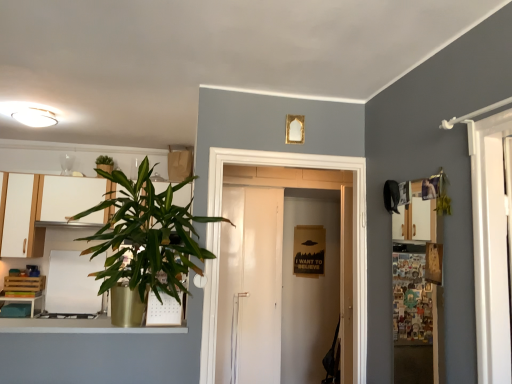
Question: From the image's perspective, would you say matte white cabinet at left, which appears as the 1th cabinetry when viewed from the left, is shown under green leafy plant at upper left, acting as the 2th houseplant starting from the right?

Choices:
 (A) yes
 (B) no

Answer: (A)

Question: Is matte white cabinet at left, which appears as the 1th cabinetry when viewed from the left, at the right side of green leafy plant at upper left, which appears as the first houseplant when viewed from the top?

Choices:
 (A) yes
 (B) no

Answer: (B)

Question: Can you confirm if matte white cabinet at left, which appears as the 1th cabinetry when viewed from the left, is bigger than green leafy plant at upper left, the first houseplant viewed from the left?

Choices:
 (A) yes
 (B) no

Answer: (A)

Question: Considering the relative positions of matte white cabinet at left, the 2th cabinetry viewed from the right, and green leafy plant at upper left, which appears as the first houseplant when viewed from the top, in the image provided, is matte white cabinet at left, the 2th cabinetry viewed from the right, to the left of green leafy plant at upper left, which appears as the first houseplant when viewed from the top, from the viewer's perspective?

Choices:
 (A) yes
 (B) no

Answer: (A)

Question: Is green leafy plant at upper left, the first houseplant viewed from the left, located within matte white cabinet at left, the 2th cabinetry viewed from the right?

Choices:
 (A) yes
 (B) no

Answer: (B)

Question: Based on their positions, is matte white cabinet at left, the 2th cabinetry viewed from the right, located to the left or right of wooden at left?

Choices:
 (A) right
 (B) left

Answer: (B)

Question: From a real-world perspective, is matte white cabinet at left, which appears as the 1th cabinetry when viewed from the left, above or below wooden at left?

Choices:
 (A) below
 (B) above

Answer: (B)

Question: From their relative heights in the image, would you say matte white cabinet at left, the 2th cabinetry viewed from the right, is taller or shorter than wooden at left?

Choices:
 (A) short
 (B) tall

Answer: (B)

Question: Based on their sizes in the image, would you say matte white cabinet at left, the 2th cabinetry viewed from the right, is bigger or smaller than wooden at left?

Choices:
 (A) small
 (B) big

Answer: (B)

Question: In terms of size, does white matte cabinet at left, the 2th cabinetry from the left, appear bigger or smaller than matte white cabinet at left, the 2th cabinetry viewed from the right?

Choices:
 (A) small
 (B) big

Answer: (B)

Question: Is white matte cabinet at left, positioned as the first cabinetry in right-to-left order, in front of or behind matte white cabinet at left, the 2th cabinetry viewed from the right, in the image?

Choices:
 (A) behind
 (B) front

Answer: (A)

Question: From a real-world perspective, is white matte cabinet at left, positioned as the first cabinetry in right-to-left order, above or below matte white cabinet at left, which appears as the 1th cabinetry when viewed from the left?

Choices:
 (A) above
 (B) below

Answer: (A)

Question: Is point (31, 253) positioned closer to the camera than point (4, 256)?

Choices:
 (A) closer
 (B) farther

Answer: (B)

Question: From a real-world perspective, is wooden at left above or below white glossy door at center?

Choices:
 (A) above
 (B) below

Answer: (B)

Question: Considering their positions, is wooden at left located in front of or behind white glossy door at center?

Choices:
 (A) front
 (B) behind

Answer: (B)